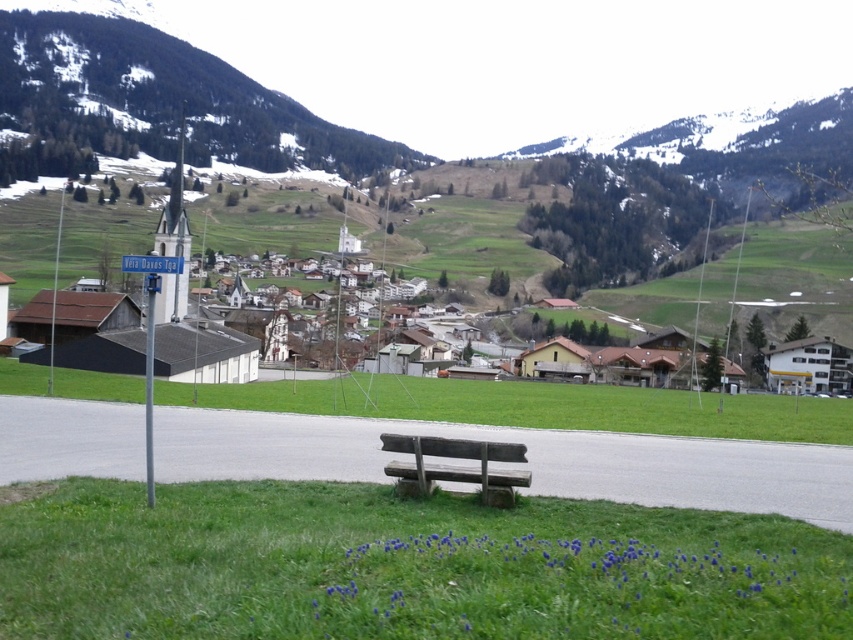
Question: Which object appears closest to the camera in this image?

Choices:
 (A) snowy rocky mountain at upper left
 (B) wooden bench at center
 (C) green grass at lower center

Answer: (C)

Question: Which object appears closest to the camera in this image?

Choices:
 (A) snowy rocky mountain at upper left
 (B) green grass at center
 (C) wooden bench at center
 (D) green grass at lower center

Answer: (D)

Question: Is green grass at lower center positioned behind wooden bench at center?

Choices:
 (A) yes
 (B) no

Answer: (B)

Question: Among these points, which one is farthest from the camera?

Choices:
 (A) 105,394
 (B) 405,480
 (C) 410,609
 (D) 138,131

Answer: (D)

Question: Can you confirm if green grass at lower center is positioned to the right of snowy rocky mountain at upper left?

Choices:
 (A) no
 (B) yes

Answer: (B)

Question: Can you confirm if green grass at lower center is positioned to the left of wooden bench at center?

Choices:
 (A) no
 (B) yes

Answer: (B)